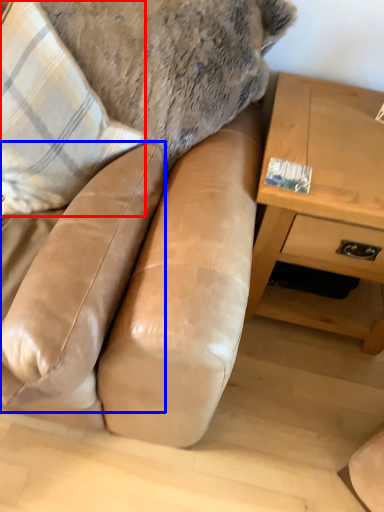
Question: Which object is further to the camera taking this photo, throw pillow (highlighted by a red box) or swivel chair (highlighted by a blue box)?

Choices:
 (A) throw pillow
 (B) swivel chair

Answer: (A)